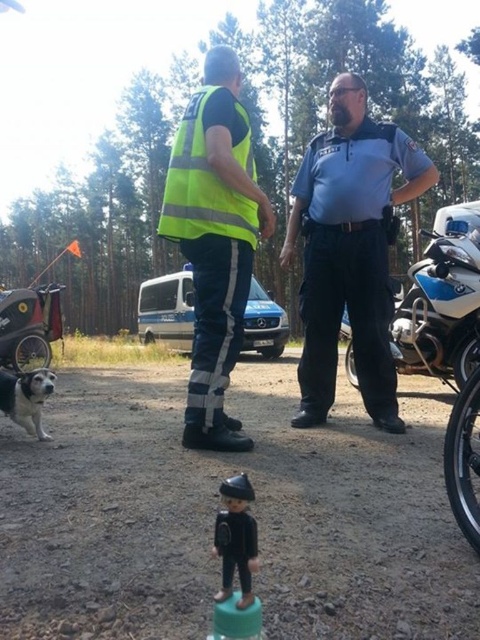
Who is more forward, [474,458] or [24,408]?

Point [474,458]

Where is `blue metallic motorcycle at right`? This screenshot has height=640, width=480. blue metallic motorcycle at right is located at coordinates (447, 344).

I want to click on blue metallic motorcycle at right, so click(x=447, y=344).

Is point (376, 384) positioned in front of point (477, 262)?

Yes, point (376, 384) is in front of point (477, 262).

Is blue uniform at center positioned before blue metallic motorcycle at right?

No, blue uniform at center is behind blue metallic motorcycle at right.

The height and width of the screenshot is (640, 480). Describe the element at coordinates (349, 250) in the screenshot. I see `blue uniform at center` at that location.

Image resolution: width=480 pixels, height=640 pixels. I want to click on blue uniform at center, so click(349, 250).

Does blue metallic motorcycle at right have a greater width compared to brushed metal stroller at lower left?

Yes, blue metallic motorcycle at right is wider than brushed metal stroller at lower left.

This screenshot has height=640, width=480. What do you see at coordinates (447, 344) in the screenshot? I see `blue metallic motorcycle at right` at bounding box center [447, 344].

Image resolution: width=480 pixels, height=640 pixels. I want to click on blue metallic motorcycle at right, so click(x=447, y=344).